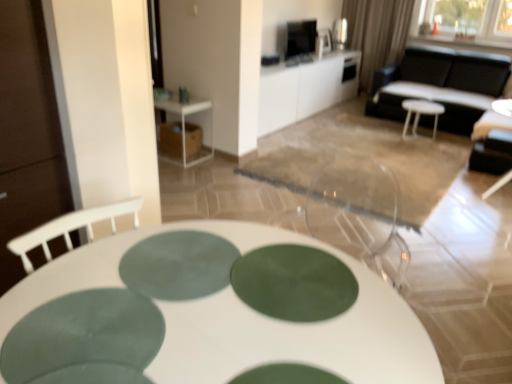
The height and width of the screenshot is (384, 512). What are the coordinates of `vacant area on top of green matte placemat at center (from a real-world perspective)` in the screenshot? It's located at (170, 268).